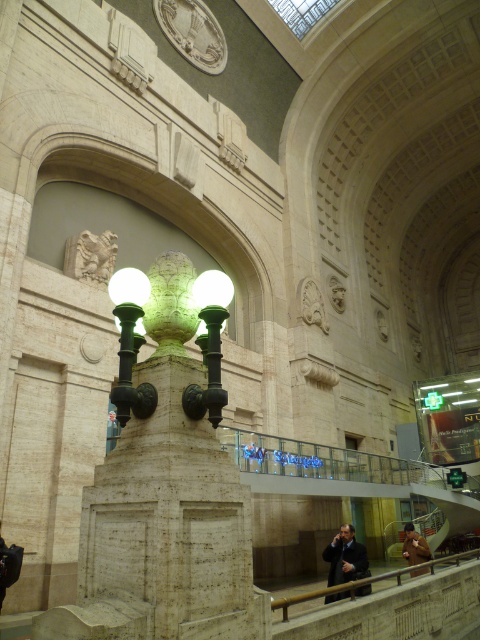
You are standing in the historic building and want to move from the green polished metal lamp post at center to the polished wood railing at lower right. Which direction should you move to get closer to the railing?

Since the green polished metal lamp post at center is closer to the viewer than the polished wood railing at lower right, you should move forward towards the railing to get closer to it.

You are an interior designer planning to place a new decorative item in the train station. You have a small statue that is the same size as the green polished stone lamp post at center. Will this statue fit on a shelf that can hold items as large as the brown leather jacket at lower right?

The green polished stone lamp post at center is smaller than the brown leather jacket at lower right. Since the statue is the same size as the lamp post, it will fit on the shelf designed to hold items as large as the brown leather jacket at lower right.